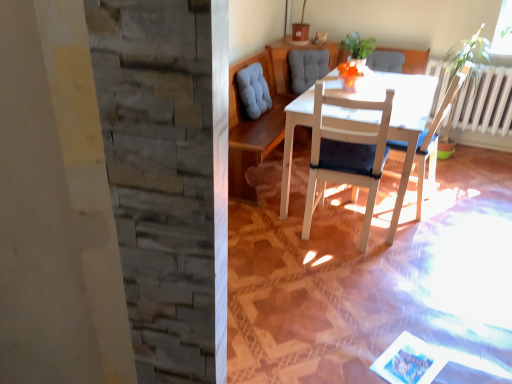
Question: Does point (357, 36) appear closer or farther from the camera than point (430, 135)?

Choices:
 (A) farther
 (B) closer

Answer: (A)

Question: In terms of height, does green leafy plant at upper center look taller or shorter compared to white wood chair at center, acting as the second chair starting from the left?

Choices:
 (A) short
 (B) tall

Answer: (A)

Question: Which of these objects is positioned farthest from the white wood table at center?

Choices:
 (A) white wood chair at center, which is counted as the first chair, starting from the left
 (B) white wood chair at center, which appears as the 1th chair when viewed from the right
 (C) green leafy plant at upper center

Answer: (C)

Question: Which object is the farthest from the white wood chair at center, which appears as the 1th chair when viewed from the right?

Choices:
 (A) white wood table at center
 (B) white wood chair at center, placed as the second chair when sorted from right to left
 (C) green leafy plant at upper center

Answer: (C)